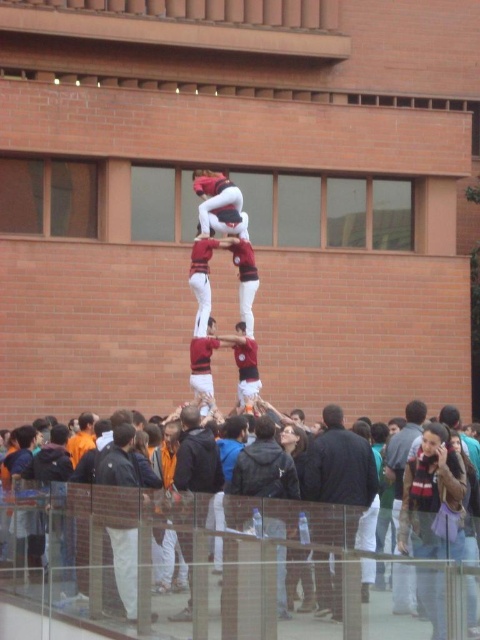
Question: Considering the relative positions of dark gray hoodie at center and maroon jersey at center in the image provided, where is dark gray hoodie at center located with respect to maroon jersey at center?

Choices:
 (A) left
 (B) right

Answer: (A)

Question: Which of these objects is positioned farthest from the maroon jersey at center?

Choices:
 (A) dark clothing crowd at lower center
 (B) dark blue jacket at center

Answer: (A)

Question: Which of the following is the farthest from the observer?

Choices:
 (A) dark gray hoodie at center
 (B) dark blue jacket at center
 (C) maroon jersey at center
 (D) dark clothing crowd at lower center

Answer: (C)

Question: Can you confirm if dark blue jacket at center is thinner than maroon jersey at center?

Choices:
 (A) yes
 (B) no

Answer: (B)

Question: Estimate the real-world distances between objects in this image. Which object is closer to the dark clothing crowd at lower center?

Choices:
 (A) maroon jersey at center
 (B) dark blue jacket at center

Answer: (B)

Question: Is dark clothing crowd at lower center closer to the viewer compared to maroon jersey at center?

Choices:
 (A) no
 (B) yes

Answer: (B)